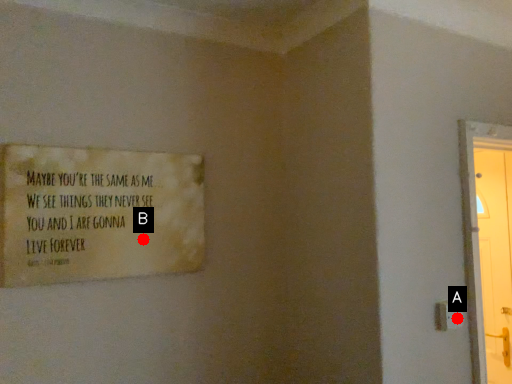
Question: Two points are circled on the image, labeled by A and B beside each circle. Which point appears farthest from the camera in this image?

Choices:
 (A) A is further
 (B) B is further

Answer: (A)